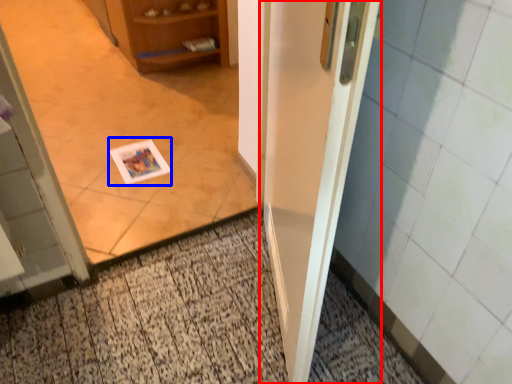
Question: Which of the following is the closest to the observer, door (highlighted by a red box) or postcard (highlighted by a blue box)?

Choices:
 (A) door
 (B) postcard

Answer: (A)